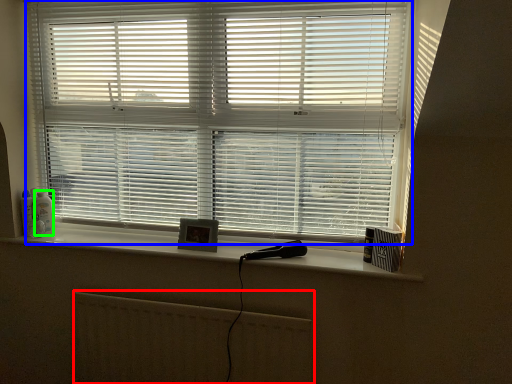
Question: Which is farther away from radiator (highlighted by a red box)? window blind (highlighted by a blue box) or toiletry (highlighted by a green box)?

Choices:
 (A) window blind
 (B) toiletry

Answer: (B)